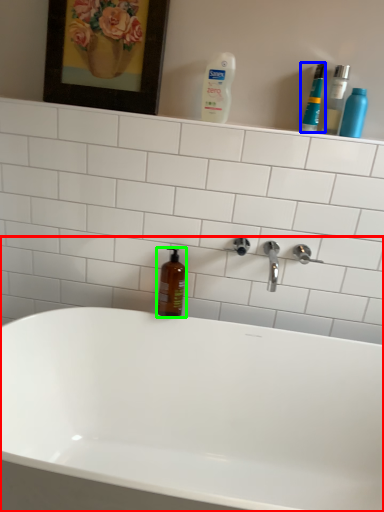
Question: Which is farther away from bathtub (highlighted by a red box)? mouthwash (highlighted by a blue box) or mouthwash (highlighted by a green box)?

Choices:
 (A) mouthwash
 (B) mouthwash

Answer: (A)